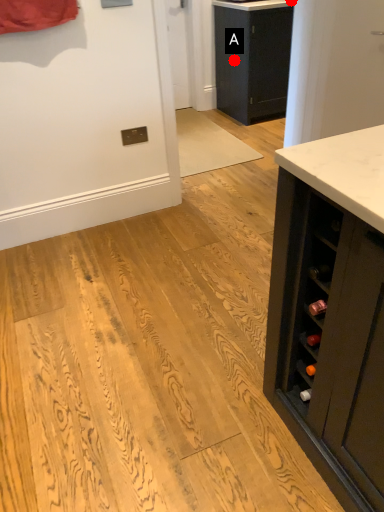
Question: Two points are circled on the image, labeled by A and B beside each circle. Which point appears closest to the camera in this image?

Choices:
 (A) A is closer
 (B) B is closer

Answer: (B)